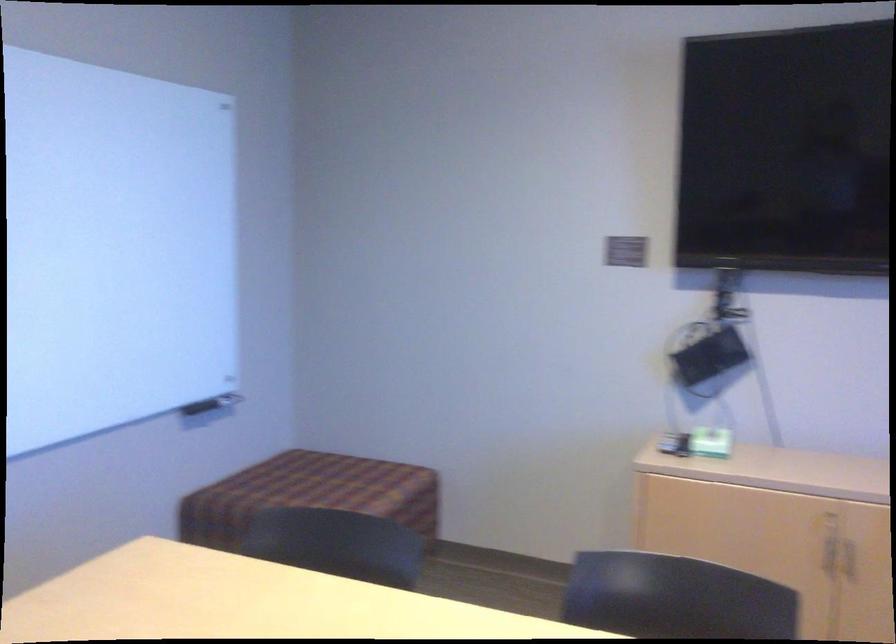
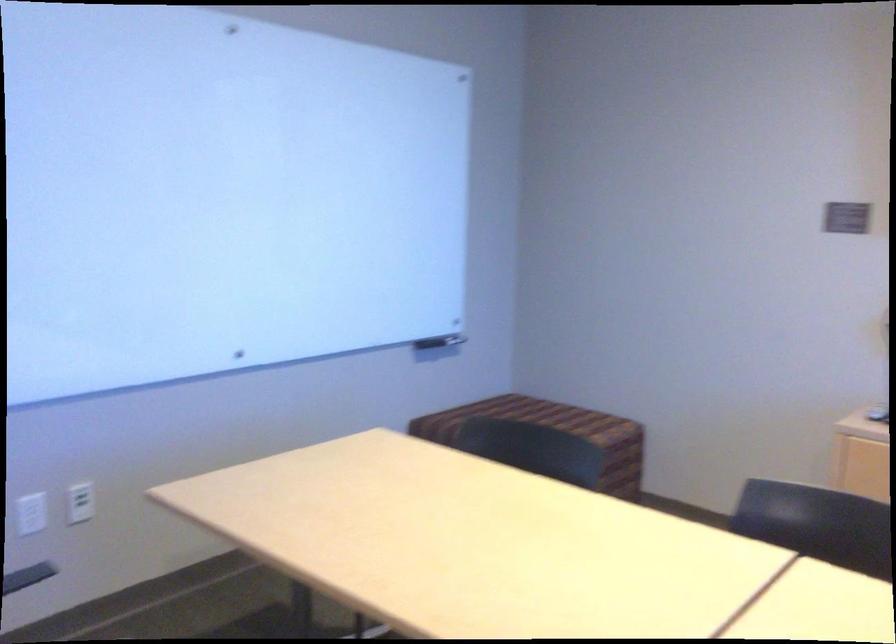
What movement of the cameraman would produce the second image?

The cameraman walked toward right, backward.